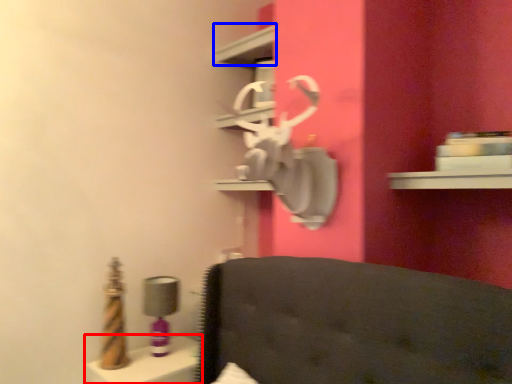
Question: Which point is further to the camera, vanity (highlighted by a red box) or shelf (highlighted by a blue box)?

Choices:
 (A) vanity
 (B) shelf

Answer: (B)